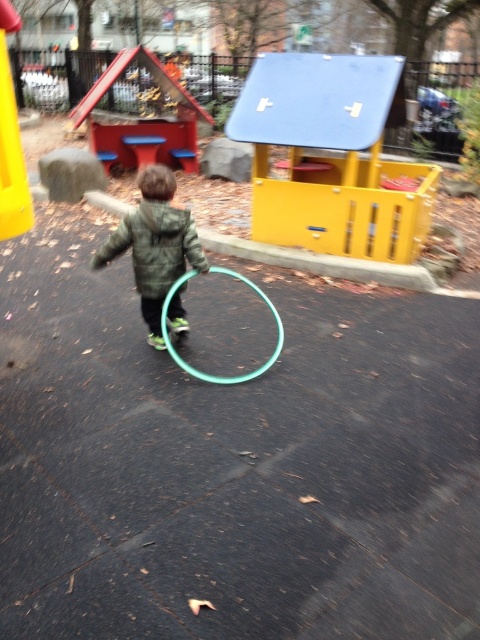
Who is positioned more to the right, yellow matte playhouse at center or teal rubber hula hoop at center?

Positioned to the right is yellow matte playhouse at center.

Describe the element at coordinates (334, 157) in the screenshot. I see `yellow matte playhouse at center` at that location.

Which is in front, point (296, 124) or point (162, 330)?

Point (162, 330) is more forward.

Where is `yellow matte playhouse at center`? yellow matte playhouse at center is located at coordinates 334,157.

This screenshot has width=480, height=640. What do you see at coordinates (334, 157) in the screenshot?
I see `yellow matte playhouse at center` at bounding box center [334, 157].

At what (x,y) coordinates should I click in order to perform the action: click on yellow matte playhouse at center. Please return your answer as a coordinate pair (x, y). This screenshot has height=640, width=480. Looking at the image, I should click on (x=334, y=157).

Image resolution: width=480 pixels, height=640 pixels. I want to click on yellow matte playhouse at center, so click(x=334, y=157).

Between red painted wooden playhouse at upper left and teal rubber hula hoop at center, which one is positioned higher?

red painted wooden playhouse at upper left is above.

Between red painted wooden playhouse at upper left and teal rubber hula hoop at center, which one is positioned lower?

Positioned lower is teal rubber hula hoop at center.

Is point (193, 136) closer to viewer compared to point (177, 280)?

No, it is behind (177, 280).

This screenshot has height=640, width=480. I want to click on red painted wooden playhouse at upper left, so (x=143, y=120).